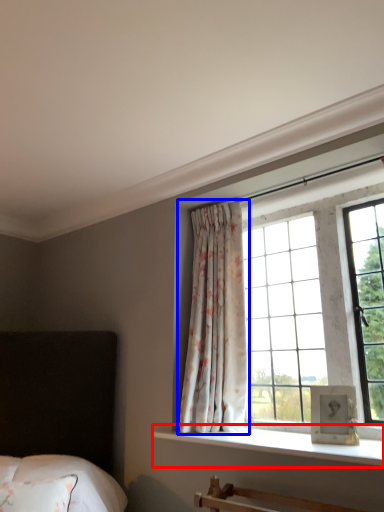
Question: Which object appears farthest to the camera in this image, window sill (highlighted by a red box) or curtain (highlighted by a blue box)?

Choices:
 (A) window sill
 (B) curtain

Answer: (B)